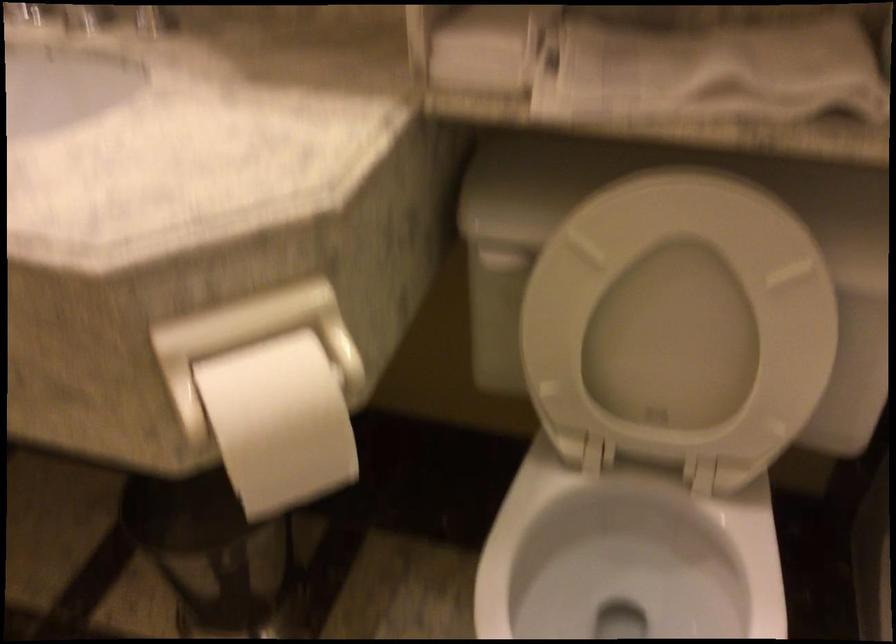
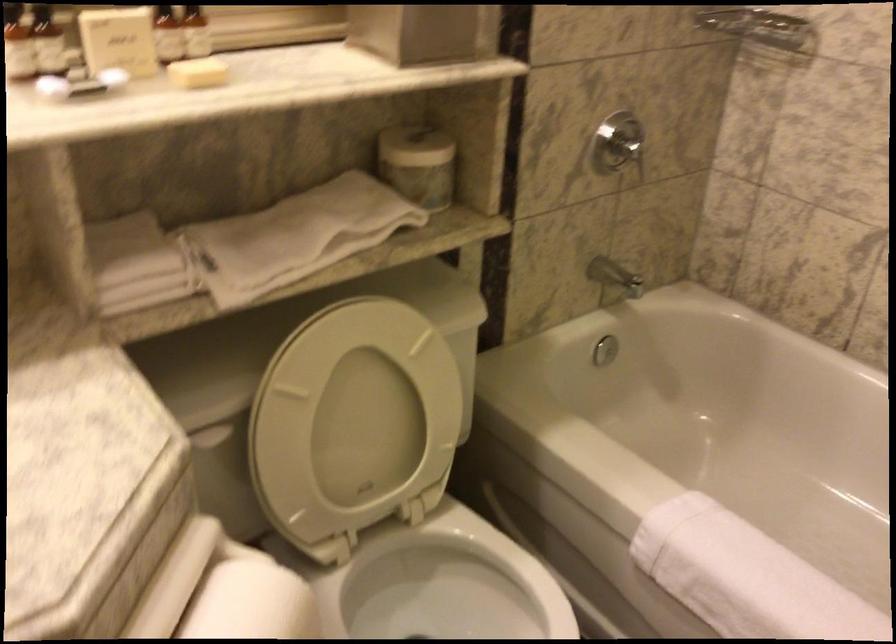
Question: The camera is either moving clockwise (left) or counter-clockwise (right) around the object. The first image is from the beginning of the video and the second image is from the end. Is the camera moving left or right when shooting the video?

Choices:
 (A) Left
 (B) Right

Answer: (A)